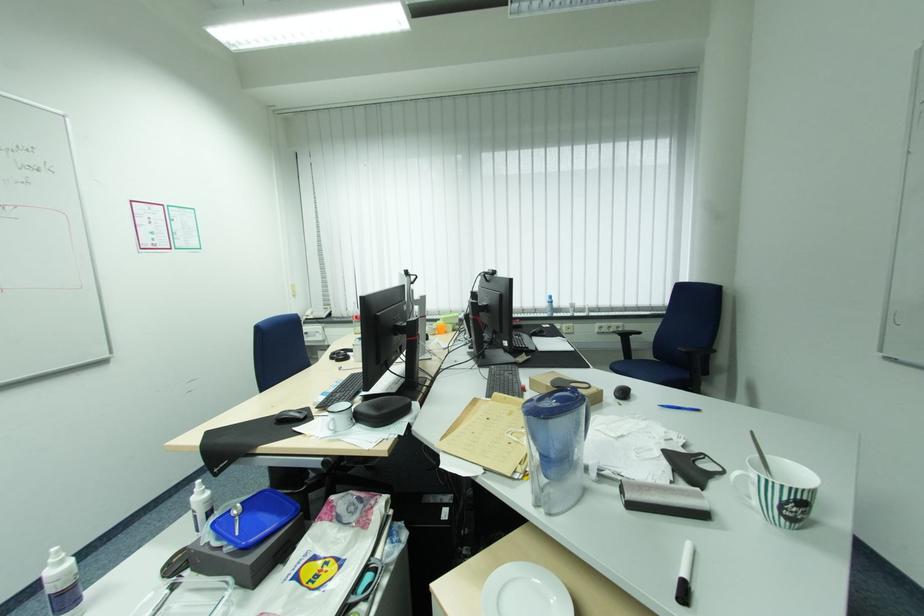
This screenshot has height=616, width=924. In order to click on white spray bottle in this screenshot , I will do `click(62, 584)`.